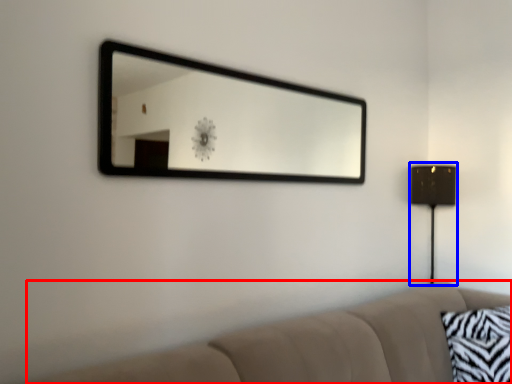
Question: Which object appears closest to the camera in this image, studio couch (highlighted by a red box) or table lamp (highlighted by a blue box)?

Choices:
 (A) studio couch
 (B) table lamp

Answer: (A)